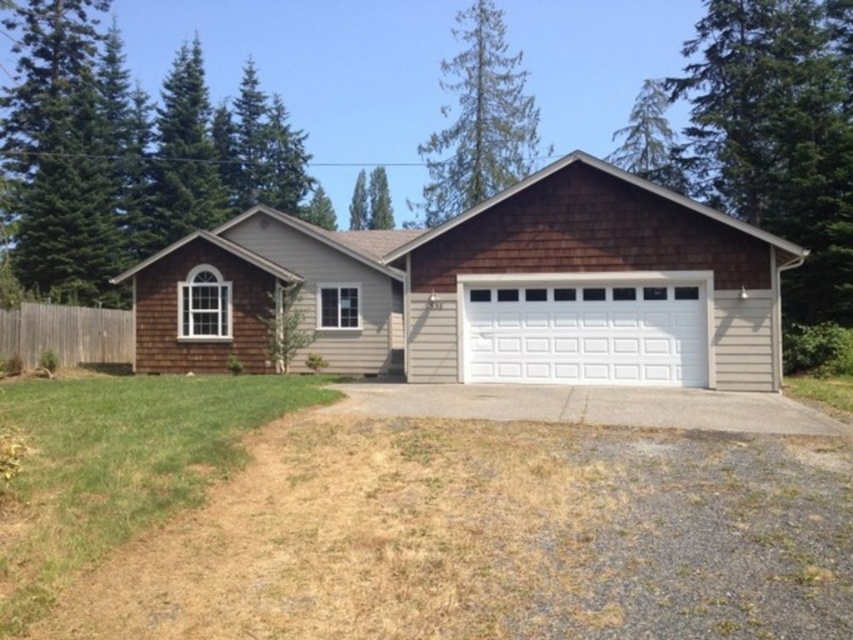
Question: Which point is farther to the camera?

Choices:
 (A) (758, 262)
 (B) (703, 412)
 (C) (616, 364)

Answer: (C)

Question: Is white painted wood garage door at center to the right of gray asphalt driveway at center from the viewer's perspective?

Choices:
 (A) yes
 (B) no

Answer: (A)

Question: Which is nearer to the gray asphalt driveway at center?

Choices:
 (A) brown shingles at center
 (B) white painted wood garage door at center

Answer: (B)

Question: Does white painted wood garage door at center have a greater width compared to gray asphalt driveway at center?

Choices:
 (A) no
 (B) yes

Answer: (A)

Question: In this image, where is brown shingles at center located relative to gray asphalt driveway at center?

Choices:
 (A) below
 (B) above

Answer: (B)

Question: Among these points, which one is farthest from the camera?

Choices:
 (A) (355, 284)
 (B) (675, 388)

Answer: (A)